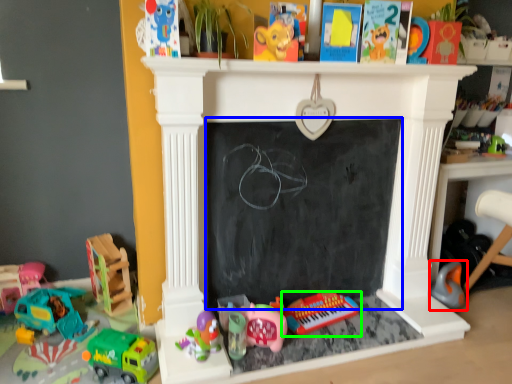
Question: Estimate the real-world distances between objects in this image. Which object is closer to toy (highlighted by a red box), bulletin board (highlighted by a blue box) or toy (highlighted by a green box)?

Choices:
 (A) bulletin board
 (B) toy

Answer: (B)